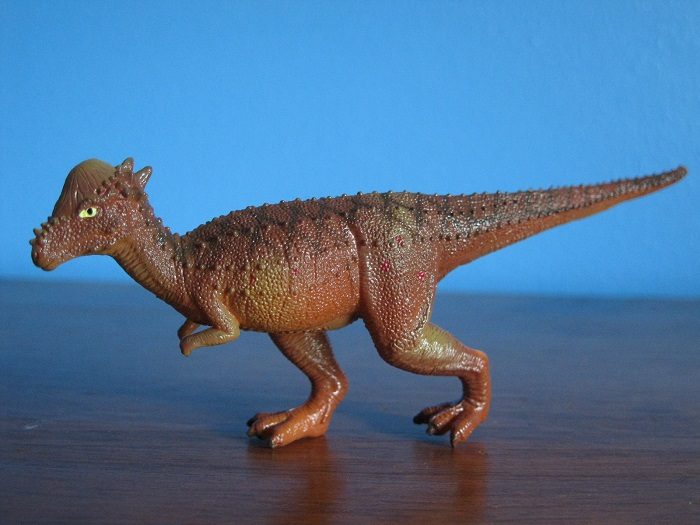
What are the coordinates of `plastic toy` in the screenshot? It's located at (327, 294).